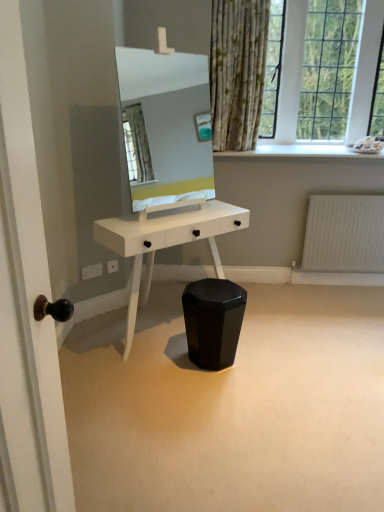
Where is `free region on the left part of white matte radiator at lower right`? Image resolution: width=384 pixels, height=512 pixels. free region on the left part of white matte radiator at lower right is located at coordinates (301, 292).